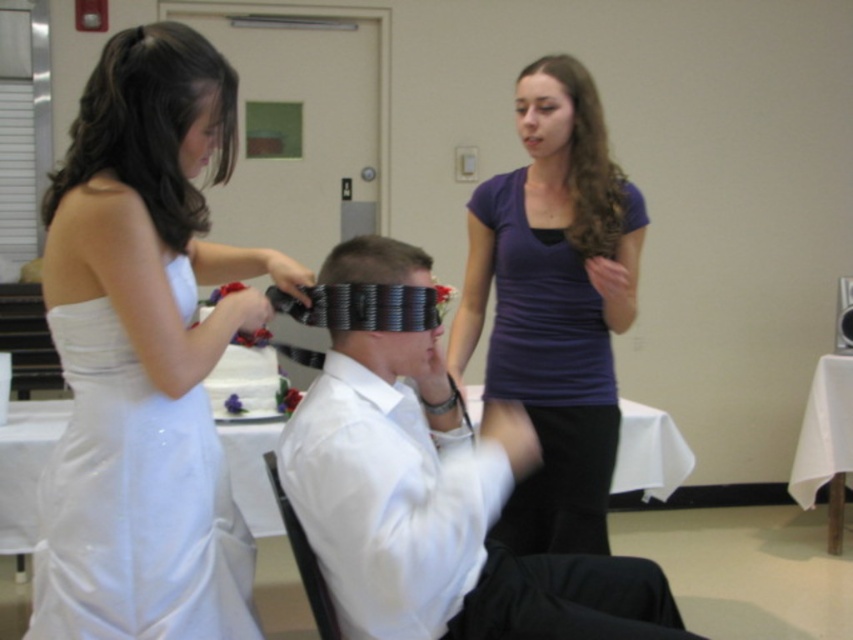
Question: Can you confirm if white glossy shirt at center is smaller than black plastic hair clips at center?

Choices:
 (A) no
 (B) yes

Answer: (A)

Question: Considering the relative positions of white satin dress at upper left and dark purple shirt at upper center in the image provided, where is white satin dress at upper left located with respect to dark purple shirt at upper center?

Choices:
 (A) above
 (B) below

Answer: (B)

Question: Which point appears closest to the camera in this image?

Choices:
 (A) (84, 92)
 (B) (184, 106)
 (C) (576, 220)

Answer: (B)

Question: Can you confirm if white satin dress at upper left is positioned to the left of dark purple shirt at upper center?

Choices:
 (A) yes
 (B) no

Answer: (A)

Question: Among these objects, which one is nearest to the camera?

Choices:
 (A) purple matte shirt at upper center
 (B) white satin dress at upper left
 (C) dark purple shirt at upper center
 (D) white satin dress at left

Answer: (D)

Question: Estimate the real-world distances between objects in this image. Which object is closer to the dark purple shirt at upper center?

Choices:
 (A) purple matte shirt at upper center
 (B) white satin dress at left
 (C) white satin dress at upper left
 (D) white glossy shirt at center

Answer: (A)